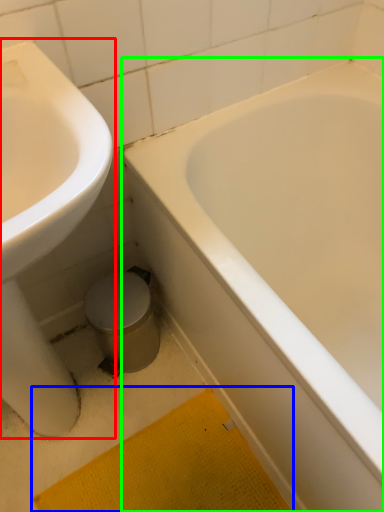
Question: Which object is the farthest from sink (highlighted by a red box)? Choose among these: bath mat (highlighted by a blue box) or bathtub (highlighted by a green box).

Choices:
 (A) bath mat
 (B) bathtub

Answer: (B)